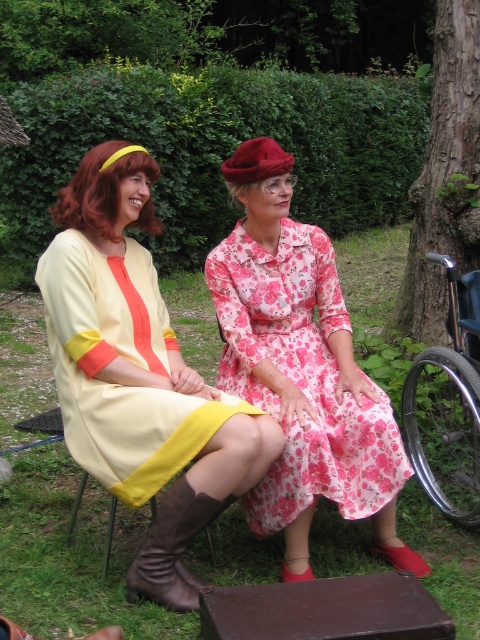
The image size is (480, 640). I want to click on pink floral fabric dress at center, so click(300, 378).

Is pink floral fabric dress at center positioned behind brown leather boot at lower left?

Yes.

Where is `pink floral fabric dress at center`? This screenshot has height=640, width=480. pink floral fabric dress at center is located at coordinates (300, 378).

Who is taller, pink floral fabric dress at center or silver metallic wheelchair at right?

pink floral fabric dress at center is taller.

The width and height of the screenshot is (480, 640). Describe the element at coordinates (300, 378) in the screenshot. I see `pink floral fabric dress at center` at that location.

You are a GUI agent. You are given a task and a screenshot of the screen. Output one action in this format:
    pyautogui.click(x=<x>, y=<y>)
    Task: Click on the pink floral fabric dress at center
    The image size is (480, 640).
    Given the screenshot: What is the action you would take?
    pyautogui.click(x=300, y=378)

Does matte yellow dress at center have a larger size compared to brown leather boot at lower left?

Yes.

Is matte yellow dress at center to the right of brown leather boot at lower left from the viewer's perspective?

No, matte yellow dress at center is not to the right of brown leather boot at lower left.

At what (x,y) coordinates should I click in order to perform the action: click on matte yellow dress at center. Please return your answer as a coordinate pair (x, y). The height and width of the screenshot is (640, 480). Looking at the image, I should click on (139, 374).